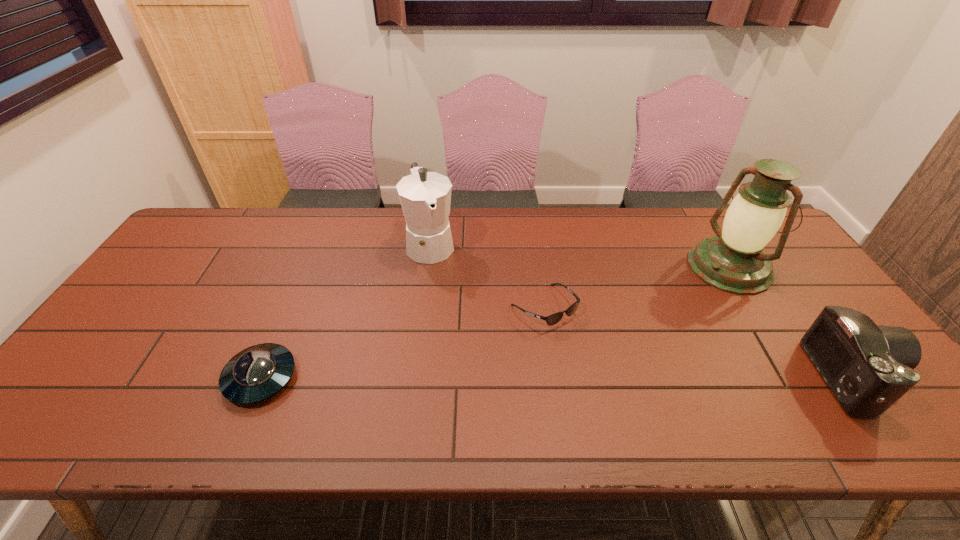
Where is `camera that is at the right edge`? camera that is at the right edge is located at coordinates (868, 367).

Image resolution: width=960 pixels, height=540 pixels. I want to click on lantern situated at the right edge, so click(x=733, y=261).

Where is `object that is at the far right corner`? object that is at the far right corner is located at coordinates (733, 261).

Locate an element on the screen. object at the near right corner is located at coordinates (868, 367).

In the image, there is a desktop. Where is `free region at the far edge`? free region at the far edge is located at coordinates (260, 233).

Where is `vacant region at the near edge`? Image resolution: width=960 pixels, height=540 pixels. vacant region at the near edge is located at coordinates (166, 382).

Locate an element on the screen. This screenshot has width=960, height=540. vacant space at the left edge of the desktop is located at coordinates (204, 273).

Where is `vacant area that lies between the second tallest object and the lantern`? vacant area that lies between the second tallest object and the lantern is located at coordinates (580, 255).

What are the coordinates of `free space between the fourth object from right to left and the saucer` in the screenshot? It's located at (346, 311).

Where is `vacant area between the camera and the fourth object from right to left`? This screenshot has height=540, width=960. vacant area between the camera and the fourth object from right to left is located at coordinates (643, 310).